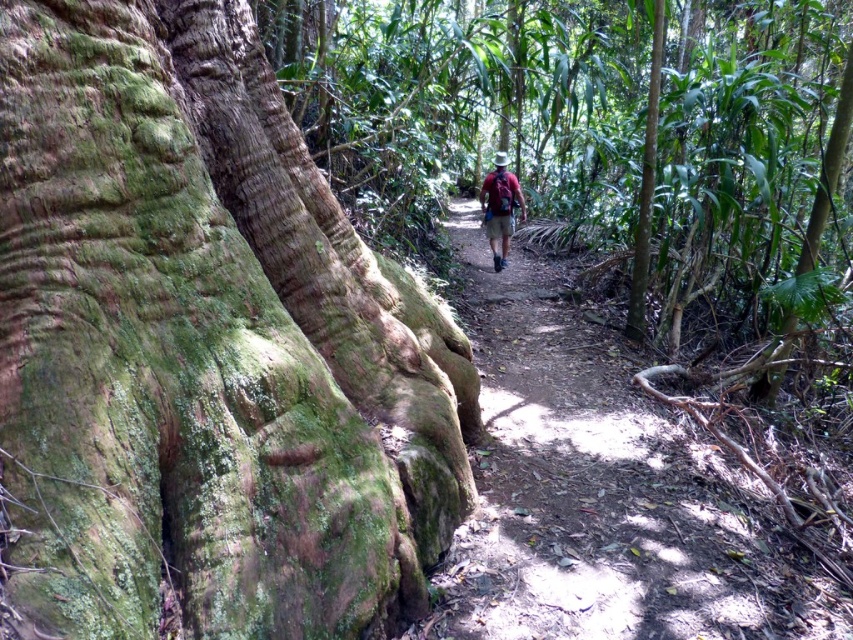
Who is lower down, brown dirt trail at center or maroon fabric backpack at center?

Positioned lower is brown dirt trail at center.

Is the position of brown dirt trail at center less distant than that of maroon fabric backpack at center?

Yes, it is.

Measure the distance between brown dirt trail at center and camera.

brown dirt trail at center and camera are 12.20 feet apart from each other.

This screenshot has width=853, height=640. I want to click on brown dirt trail at center, so click(x=602, y=490).